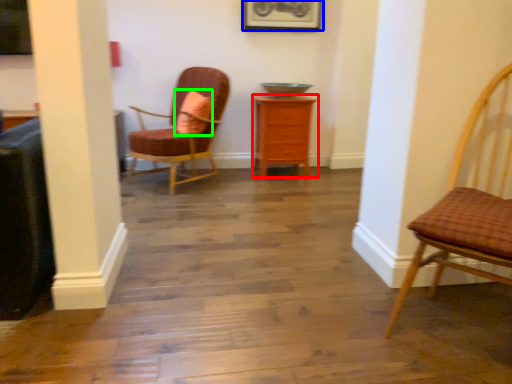
Question: Estimate the real-world distances between objects in this image. Which object is farther from chest of drawers (highlighted by a red box), picture frame (highlighted by a blue box) or pillow (highlighted by a green box)?

Choices:
 (A) picture frame
 (B) pillow

Answer: (A)